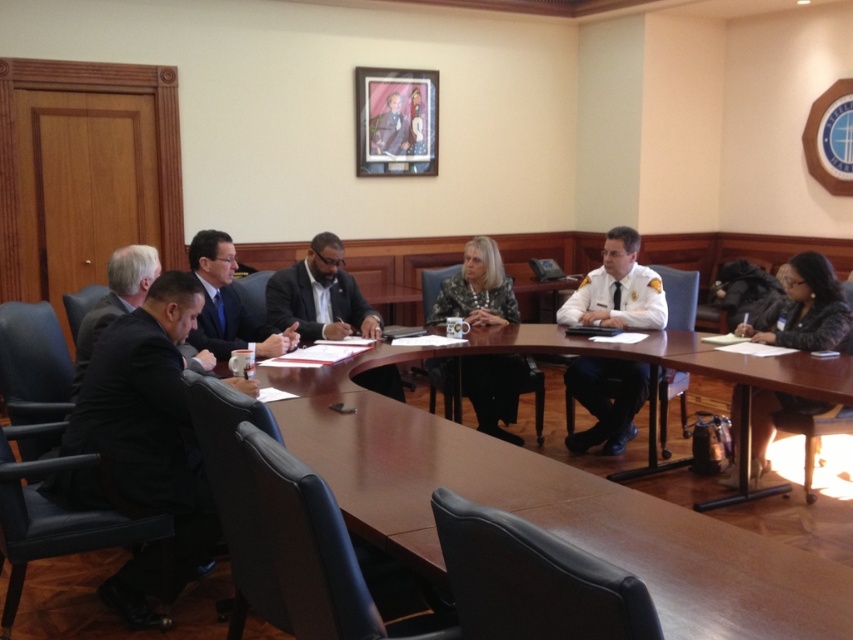
Between camouflage-patterned shirt at center and matte black suit at center, which one has more height?

Standing taller between the two is camouflage-patterned shirt at center.

Is camouflage-patterned shirt at center wider than matte black suit at center?

Indeed, camouflage-patterned shirt at center has a greater width compared to matte black suit at center.

Identify the location of camouflage-patterned shirt at center. Image resolution: width=853 pixels, height=640 pixels. (477, 289).

Locate an element on the screen. This screenshot has width=853, height=640. camouflage-patterned shirt at center is located at coordinates (477, 289).

Is brown polished wood table at center closer to the viewer compared to black fur coat at lower right?

Yes, brown polished wood table at center is closer to the viewer.

Between point (759, 360) and point (802, 280), which one is positioned in front?

Point (759, 360) is more forward.

Is point (622, 497) positioned after point (793, 324)?

No, it is not.

Locate an element on the screen. brown polished wood table at center is located at coordinates (567, 486).

Is point (608, 454) less distant than point (242, 323)?

No.

Can you confirm if white uniform at center is smaller than matte black suit at center?

No, white uniform at center is not smaller than matte black suit at center.

What do you see at coordinates (618, 289) in the screenshot? The height and width of the screenshot is (640, 853). I see `white uniform at center` at bounding box center [618, 289].

At what (x,y) coordinates should I click in order to perform the action: click on white uniform at center. Please return your answer as a coordinate pair (x, y). Looking at the image, I should click on (618, 289).